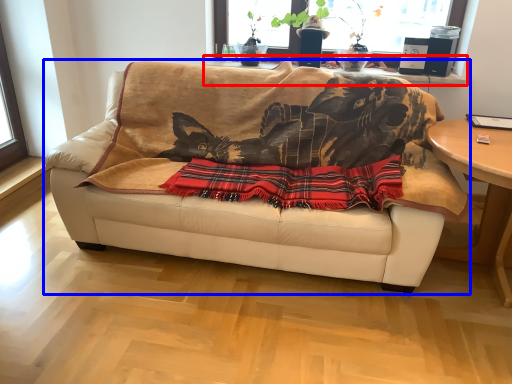
Question: Which of the following is the farthest to the observer, window sill (highlighted by a red box) or studio couch (highlighted by a blue box)?

Choices:
 (A) window sill
 (B) studio couch

Answer: (A)